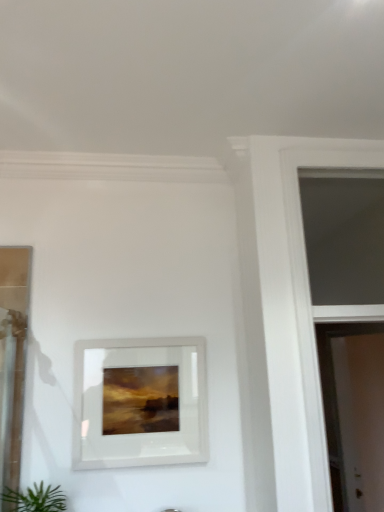
Image resolution: width=384 pixels, height=512 pixels. Describe the element at coordinates (36, 499) in the screenshot. I see `green leafy plant at lower left` at that location.

This screenshot has width=384, height=512. Find the location of `green leafy plant at lower left`. green leafy plant at lower left is located at coordinates (36, 499).

From the image's perspective, is white glossy screen door at right above or below transparent glass window at upper right?

From the image's perspective, white glossy screen door at right appears below transparent glass window at upper right.

Could you tell me if white glossy screen door at right is turned towards transparent glass window at upper right?

No, white glossy screen door at right is not aimed at transparent glass window at upper right.

Between white glossy screen door at right and transparent glass window at upper right, which one has less height?

With less height is transparent glass window at upper right.

Would you say white glossy picture frame at center is part of white glossy screen door at right's contents?

No.

From the image's perspective, which is above, white glossy screen door at right or white glossy picture frame at center?

white glossy picture frame at center.

Is white glossy screen door at right oriented towards white glossy picture frame at center?

No.

This screenshot has height=512, width=384. I want to click on picture frame above the white glossy screen door at right (from the image's perspective), so click(140, 402).

Does white glossy picture frame at center touch transparent glass window at upper right?

white glossy picture frame at center and transparent glass window at upper right are clearly separated.

Is white glossy picture frame at center facing towards transparent glass window at upper right?

No.

From the image's perspective, does white glossy picture frame at center appear higher than transparent glass window at upper right?

No, from the image's perspective, white glossy picture frame at center is not on top of transparent glass window at upper right.

The height and width of the screenshot is (512, 384). In order to click on picture frame behind the transparent glass window at upper right in this screenshot , I will do `click(140, 402)`.

Consider the image. Is white glossy picture frame at center inside the boundaries of white glossy screen door at right, or outside?

white glossy picture frame at center is not inside white glossy screen door at right, it's outside.

Is white glossy picture frame at center taller than white glossy screen door at right?

No.

Which is in front, point (200, 456) or point (321, 373)?

The point (200, 456) is closer to the camera.

Identify the location of houseplant below the white glossy picture frame at center (from the image's perspective). (36, 499).

Is green leafy plant at lower left situated inside white glossy picture frame at center or outside?

green leafy plant at lower left exists outside the volume of white glossy picture frame at center.

Are green leafy plant at lower left and white glossy picture frame at center far apart?

No, green leafy plant at lower left is not far from white glossy picture frame at center.

Does point (24, 500) lie in front of point (80, 347)?

Yes, it is.

From the image's perspective, is transparent glass window at upper right located above white glossy screen door at right?

Correct, transparent glass window at upper right appears higher than white glossy screen door at right in the image.

Does transparent glass window at upper right appear on the right side of white glossy screen door at right?

In fact, transparent glass window at upper right is to the left of white glossy screen door at right.

Looking at the image, does transparent glass window at upper right seem bigger or smaller compared to white glossy screen door at right?

In the image, transparent glass window at upper right appears to be smaller than white glossy screen door at right.

At what (x,y) coordinates should I click in order to perform the action: click on window above the white glossy screen door at right (from the image's perspective). Please return your answer as a coordinate pair (x, y). The width and height of the screenshot is (384, 512). Looking at the image, I should click on (344, 236).

From a real-world perspective, who is located lower, white glossy picture frame at center or green leafy plant at lower left?

In real-world perspective, green leafy plant at lower left is lower.

Consider the image. Which object is closer to the camera, white glossy picture frame at center or green leafy plant at lower left?

green leafy plant at lower left is more forward.

Identify the location of picture frame that appears on the right of green leafy plant at lower left. (140, 402).

Do you think white glossy picture frame at center is within green leafy plant at lower left, or outside of it?

white glossy picture frame at center cannot be found inside green leafy plant at lower left.

Identify the location of screen door lying below the transparent glass window at upper right (from the image's perspective). The width and height of the screenshot is (384, 512). (335, 397).

I want to click on picture frame that appears above the white glossy screen door at right (from the image's perspective), so click(140, 402).

Estimate the real-world distances between objects in this image. Which object is further from transparent glass window at upper right, white glossy screen door at right or green leafy plant at lower left?

green leafy plant at lower left is further to transparent glass window at upper right.

Which object lies nearer to the anchor point transparent glass window at upper right, green leafy plant at lower left or white glossy screen door at right?

Among the two, white glossy screen door at right is located nearer to transparent glass window at upper right.

When comparing their distances from green leafy plant at lower left, does white glossy screen door at right or white glossy picture frame at center seem further?

white glossy screen door at right.

Looking at the image, which one is located closer to white glossy picture frame at center, green leafy plant at lower left or white glossy screen door at right?

green leafy plant at lower left is closer to white glossy picture frame at center.

Looking at the image, which one is located further to green leafy plant at lower left, white glossy screen door at right or transparent glass window at upper right?

white glossy screen door at right lies further to green leafy plant at lower left than the other object.

From the image, which object appears to be nearer to green leafy plant at lower left, transparent glass window at upper right or white glossy picture frame at center?

Based on the image, white glossy picture frame at center appears to be nearer to green leafy plant at lower left.

When comparing their distances from green leafy plant at lower left, does transparent glass window at upper right or white glossy screen door at right seem closer?

transparent glass window at upper right is positioned closer to the anchor green leafy plant at lower left.

Which object lies further to the anchor point transparent glass window at upper right, green leafy plant at lower left or white glossy picture frame at center?

Based on the image, green leafy plant at lower left appears to be further to transparent glass window at upper right.

The image size is (384, 512). What are the coordinates of `window between white glossy picture frame at center and white glossy screen door at right in the horizontal direction` in the screenshot? It's located at (344, 236).

Find the location of `window located between green leafy plant at lower left and white glossy screen door at right in the left-right direction`. window located between green leafy plant at lower left and white glossy screen door at right in the left-right direction is located at coordinates (344, 236).

The height and width of the screenshot is (512, 384). In order to click on picture frame between green leafy plant at lower left and transparent glass window at upper right in the horizontal direction in this screenshot , I will do `click(140, 402)`.

This screenshot has width=384, height=512. Identify the location of picture frame located between green leafy plant at lower left and white glossy screen door at right in the left-right direction. (140, 402).